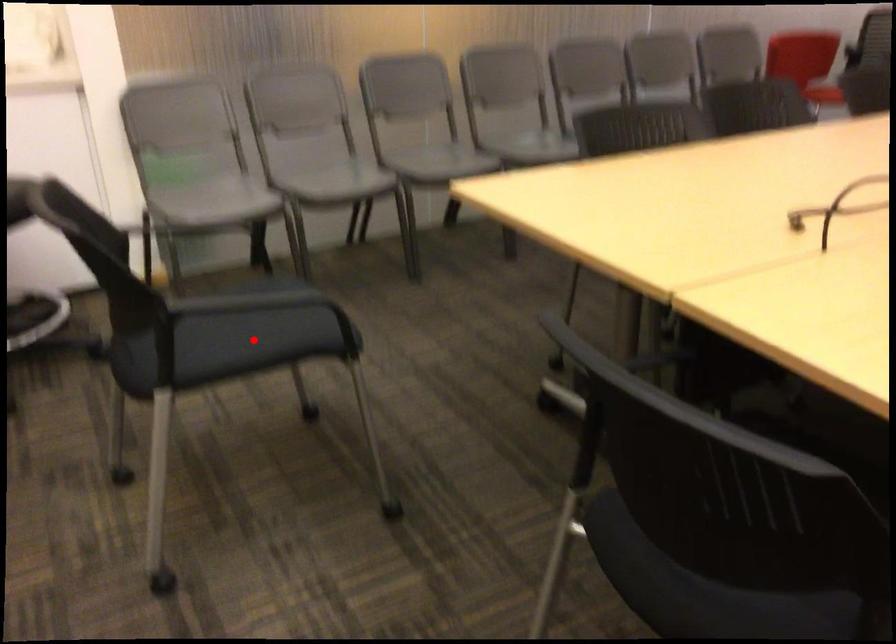
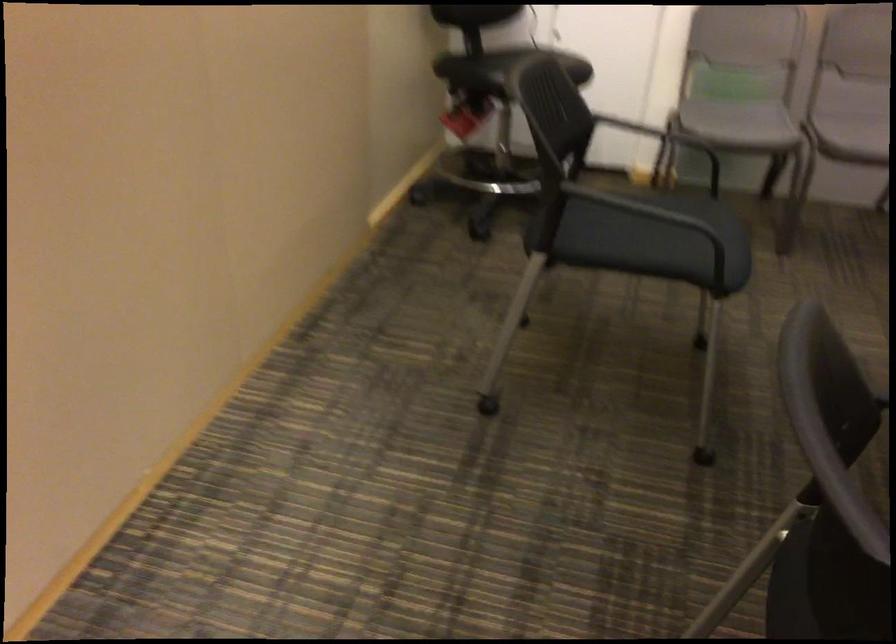
The point at the highlighted location is marked in the first image. Where is the corresponding point in the second image?

(655, 240)